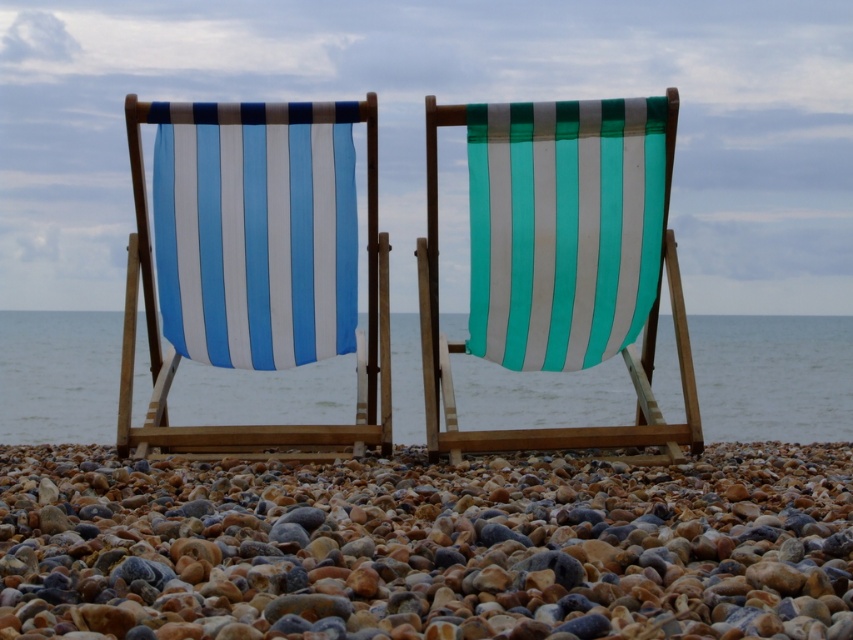
Question: Is smooth pebbles at center bigger than blue striped fabric at left?

Choices:
 (A) no
 (B) yes

Answer: (A)

Question: Observing the image, what is the correct spatial positioning of smooth pebbles at center in reference to blue striped fabric at left?

Choices:
 (A) below
 (B) above

Answer: (A)

Question: Does smooth pebbles at center have a lesser width compared to blue striped fabric at left?

Choices:
 (A) no
 (B) yes

Answer: (A)

Question: Estimate the real-world distances between objects in this image. Which object is closer to the blue striped fabric at left?

Choices:
 (A) smooth pebbles at center
 (B) blue water at center

Answer: (A)

Question: Which point appears farthest from the camera in this image?

Choices:
 (A) (341, 557)
 (B) (142, 173)
 (C) (740, 355)

Answer: (C)

Question: Which point is closer to the camera taking this photo?

Choices:
 (A) (483, 426)
 (B) (601, 314)
 (C) (222, 106)
 (D) (595, 486)

Answer: (D)